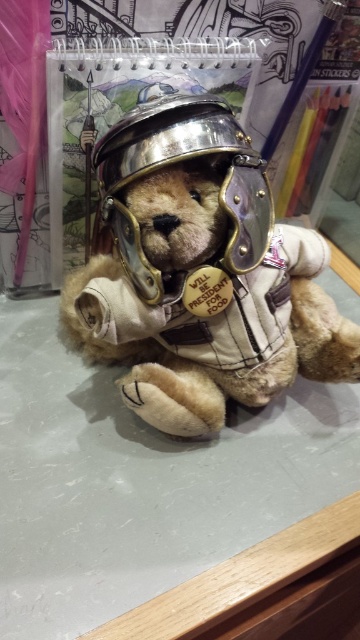
Question: Is velvet brown teddy bear at center above metallic silver helmet at center?

Choices:
 (A) yes
 (B) no

Answer: (B)

Question: Can you confirm if velvet brown teddy bear at center is positioned to the left of metallic silver helmet at center?

Choices:
 (A) yes
 (B) no

Answer: (A)

Question: Among these points, which one is nearest to the camera?

Choices:
 (A) (189, 257)
 (B) (160, 109)

Answer: (B)

Question: Which point is closer to the camera taking this photo?

Choices:
 (A) (177, 106)
 (B) (246, 388)

Answer: (A)

Question: Does velvet brown teddy bear at center have a lesser width compared to metallic silver helmet at center?

Choices:
 (A) yes
 (B) no

Answer: (B)